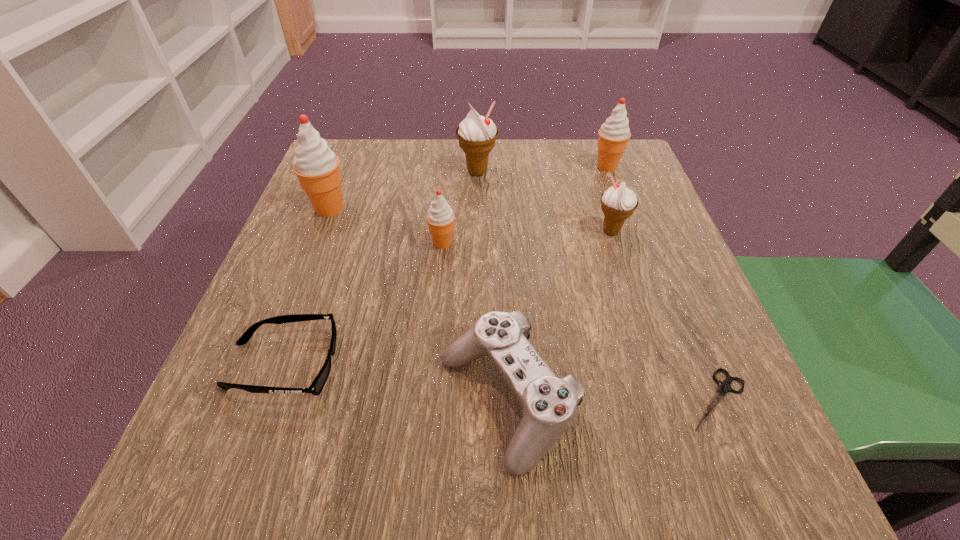
Where is `control`? control is located at coordinates (549, 403).

Locate an element on the screen. Image resolution: width=960 pixels, height=540 pixels. the third shortest object is located at coordinates (549, 403).

This screenshot has width=960, height=540. In order to click on black sunglasses in this screenshot , I will do `click(316, 387)`.

Where is `sunglasses`? sunglasses is located at coordinates (316, 387).

Where is `black shears`? black shears is located at coordinates (724, 387).

Locate an element on the screen. This screenshot has width=960, height=540. the shortest object is located at coordinates (724, 387).

Find the location of `vacant space located on the back of the tallest icecream`. vacant space located on the back of the tallest icecream is located at coordinates (348, 160).

The width and height of the screenshot is (960, 540). Identify the location of vacant space located on the left of the rightmost red icecream. (516, 167).

I want to click on vacant space located 0.270m on the right of the left white icecream, so click(612, 172).

Where is `vacant space located on the left of the second red icecream from right to left`? The height and width of the screenshot is (540, 960). vacant space located on the left of the second red icecream from right to left is located at coordinates 357,243.